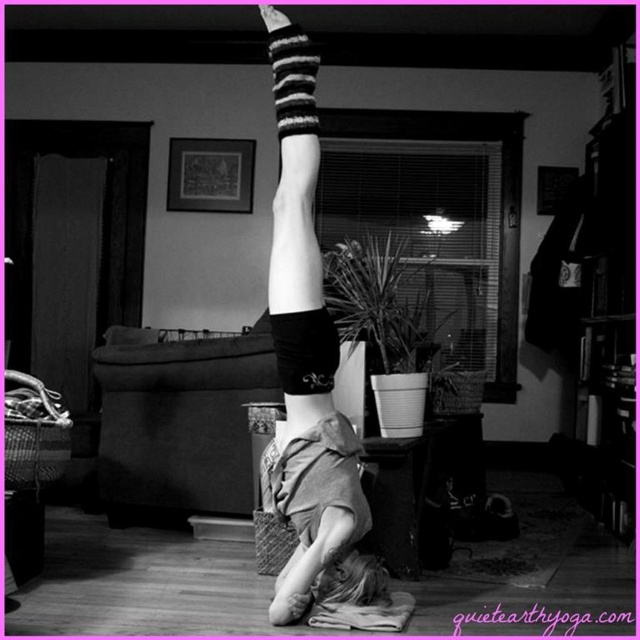
Consider the image. Does smooth skin gymnast at center appear under black striped sock at upper center?

Yes.

Does smooth skin gymnast at center appear on the right side of black striped sock at upper center?

Correct, you'll find smooth skin gymnast at center to the right of black striped sock at upper center.

Find the location of a particular element. The image size is (640, 640). smooth skin gymnast at center is located at coordinates (308, 364).